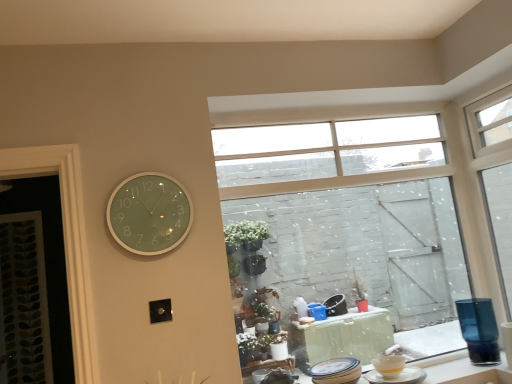
Question: Can you confirm if yellow glossy cup at lower right, arranged as the third tableware when viewed from the left, is bigger than white ceramic plate at lower right, the first tableware in the left-to-right sequence?

Choices:
 (A) yes
 (B) no

Answer: (B)

Question: Is white ceramic plate at lower right, placed as the 3th tableware when sorted from right to left, surrounded by yellow glossy cup at lower right, arranged as the third tableware when viewed from the left?

Choices:
 (A) yes
 (B) no

Answer: (B)

Question: Can you confirm if yellow glossy cup at lower right, placed as the first tableware when sorted from right to left, is smaller than white ceramic plate at lower right, the first tableware in the left-to-right sequence?

Choices:
 (A) yes
 (B) no

Answer: (A)

Question: Is yellow glossy cup at lower right, arranged as the third tableware when viewed from the left, completely or partially outside of white ceramic plate at lower right, placed as the 3th tableware when sorted from right to left?

Choices:
 (A) no
 (B) yes

Answer: (B)

Question: Can you see yellow glossy cup at lower right, arranged as the third tableware when viewed from the left, touching white ceramic plate at lower right, the first tableware in the left-to-right sequence?

Choices:
 (A) no
 (B) yes

Answer: (A)

Question: Is yellow glossy cup at lower right, arranged as the third tableware when viewed from the left, positioned behind white ceramic plate at lower right, placed as the 3th tableware when sorted from right to left?

Choices:
 (A) no
 (B) yes

Answer: (B)

Question: Can you confirm if white ceramic plate at lower right, placed as the 3th tableware when sorted from right to left, is thinner than clear glass window at upper right, the 1th window viewed from the right?

Choices:
 (A) no
 (B) yes

Answer: (A)

Question: Is white ceramic plate at lower right, the first tableware in the left-to-right sequence, positioned before clear glass window at upper right, the 1th window viewed from the right?

Choices:
 (A) yes
 (B) no

Answer: (A)

Question: Considering the relative positions of white ceramic plate at lower right, placed as the 3th tableware when sorted from right to left, and clear glass window at upper right, the second window from the left, in the image provided, is white ceramic plate at lower right, placed as the 3th tableware when sorted from right to left, to the right of clear glass window at upper right, the second window from the left, from the viewer's perspective?

Choices:
 (A) yes
 (B) no

Answer: (B)

Question: Is white ceramic plate at lower right, placed as the 3th tableware when sorted from right to left, with clear glass window at upper right, the 1th window viewed from the right?

Choices:
 (A) no
 (B) yes

Answer: (A)

Question: From a real-world perspective, is white ceramic plate at lower right, placed as the 3th tableware when sorted from right to left, positioned over clear glass window at upper right, the second window from the left, based on gravity?

Choices:
 (A) no
 (B) yes

Answer: (A)

Question: Is white ceramic plate at lower right, placed as the 3th tableware when sorted from right to left, smaller than clear glass window at upper right, the second window from the left?

Choices:
 (A) no
 (B) yes

Answer: (B)

Question: Is yellow matte bowl at lower right, marked as the second tableware in a left-to-right arrangement, in contact with clear glass window at upper center, which is the second window in right-to-left order?

Choices:
 (A) no
 (B) yes

Answer: (A)